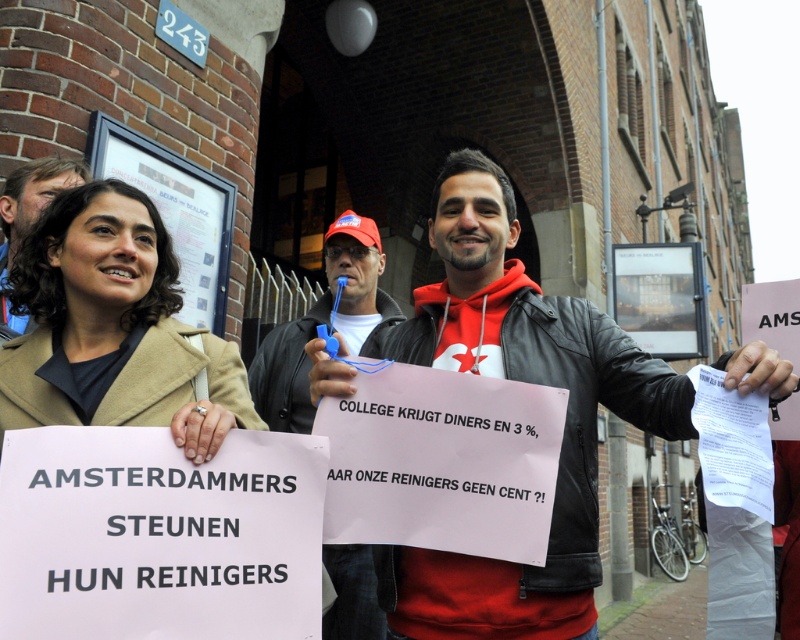
Does red leather jacket at center have a greater width compared to beige wool coat at center?

Yes.

This screenshot has height=640, width=800. What are the coordinates of `red leather jacket at center` in the screenshot? It's located at (521, 380).

Which is behind, point (437, 333) or point (362, 326)?

The point (362, 326) is behind.

From the picture: Is the position of red leather jacket at center more distant than that of matte black jacket at center?

No, red leather jacket at center is closer to the viewer.

Between point (594, 442) and point (280, 336), which one is positioned in front?

Point (594, 442) is in front.

This screenshot has width=800, height=640. Find the location of `red leather jacket at center`. red leather jacket at center is located at coordinates (521, 380).

Who is lower down, red leather jacket at center or matte black jacket at upper left?

red leather jacket at center is lower down.

Does point (594, 545) lie behind point (14, 186)?

No, (594, 545) is closer to viewer.

In order to click on red leather jacket at center in this screenshot , I will do `click(521, 380)`.